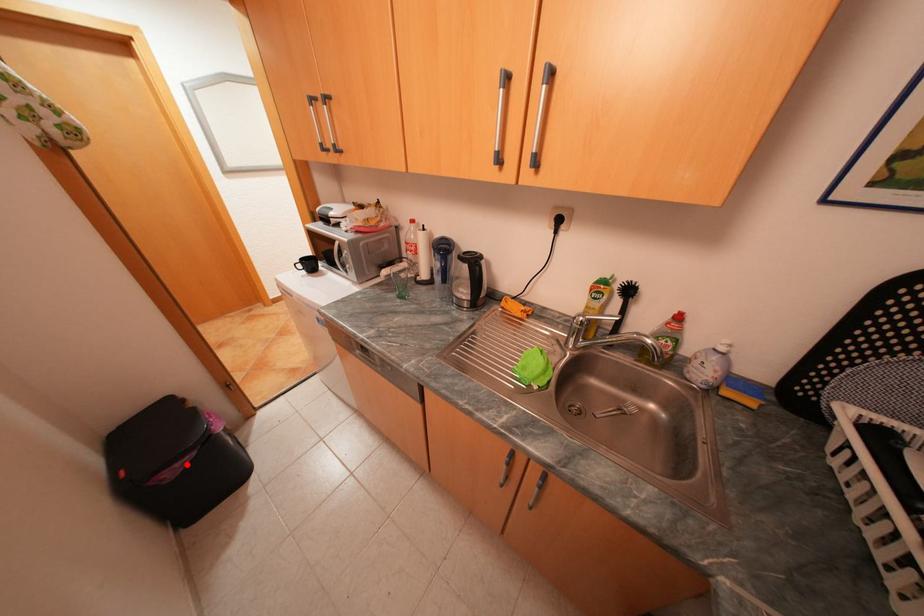
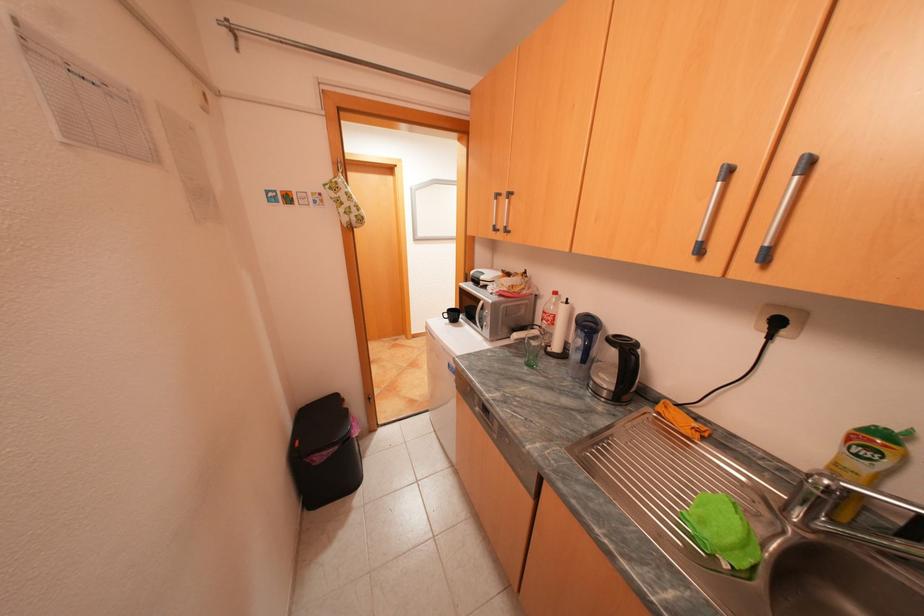
Where in the second image is the point corresponding to the highlighted location from the first image?

(334, 453)